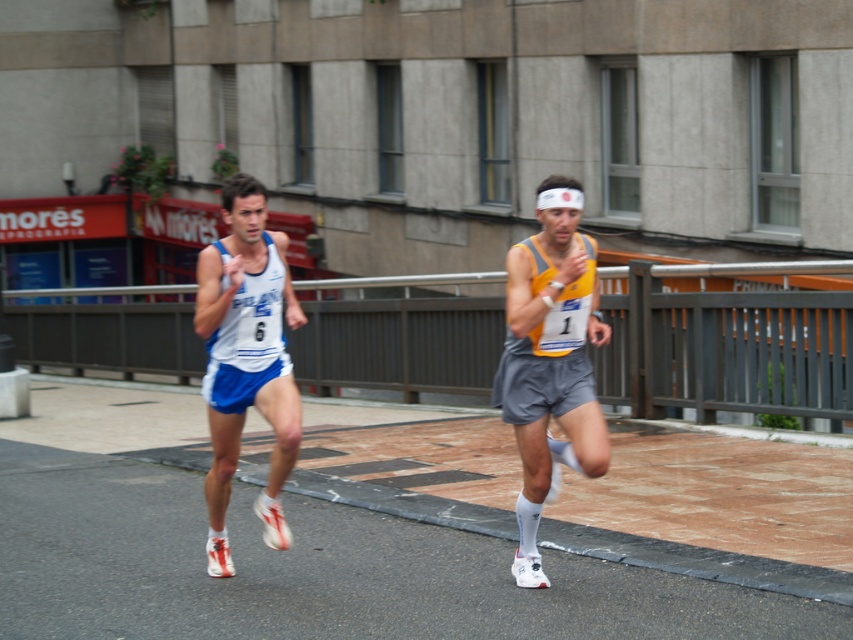
Question: Is yellow fabric tank top at center to the left of white fabric tank top at left from the viewer's perspective?

Choices:
 (A) yes
 (B) no

Answer: (B)

Question: Which point is closer to the camera?

Choices:
 (A) (523, 305)
 (B) (230, 449)

Answer: (A)

Question: Is yellow fabric tank top at center thinner than white fabric tank top at left?

Choices:
 (A) no
 (B) yes

Answer: (B)

Question: Is yellow fabric tank top at center positioned before white fabric tank top at left?

Choices:
 (A) no
 (B) yes

Answer: (B)

Question: Which object is farther from the camera taking this photo?

Choices:
 (A) yellow fabric tank top at center
 (B) white fabric tank top at left

Answer: (B)